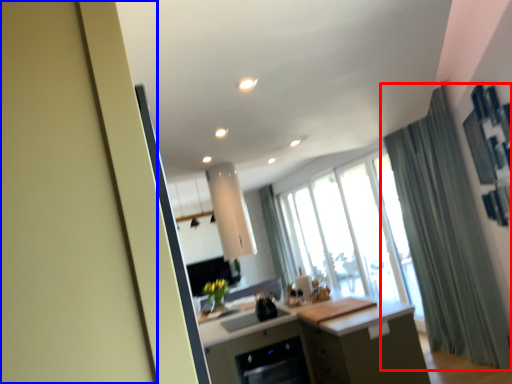
Question: Among these objects, which one is nearest to the camera, curtain (highlighted by a red box) or screen door (highlighted by a blue box)?

Choices:
 (A) curtain
 (B) screen door

Answer: (B)